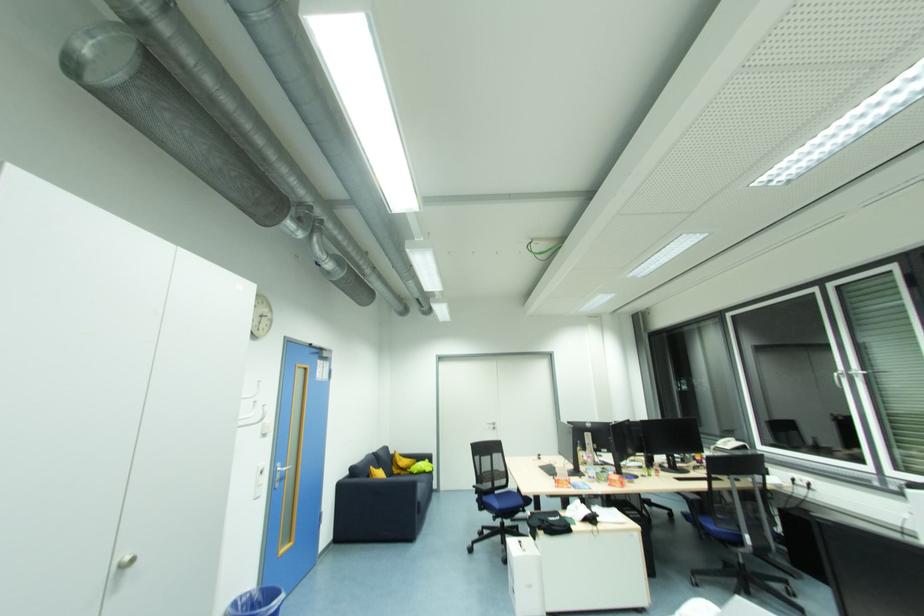
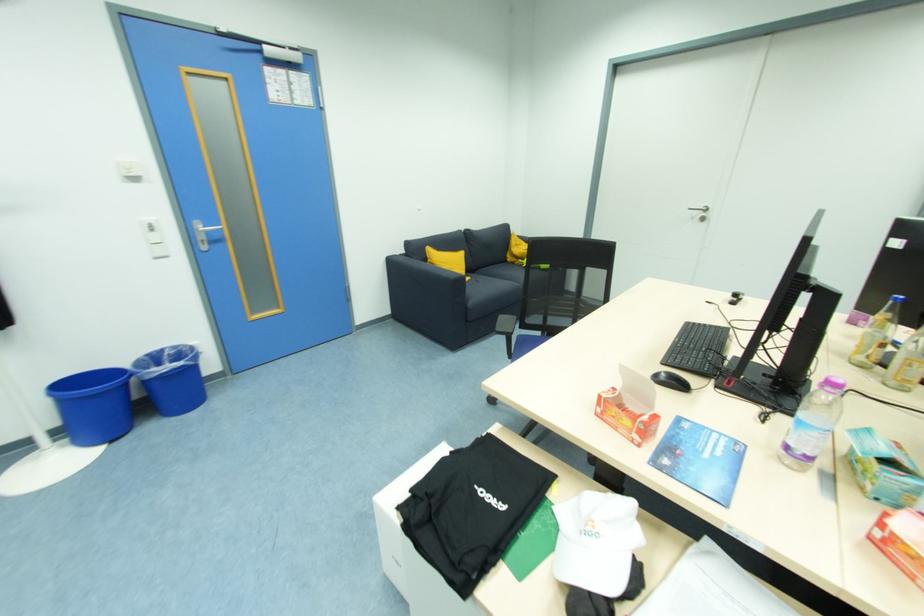
Find the pixel in the second image that matches [576,519] in the first image.

(563, 535)